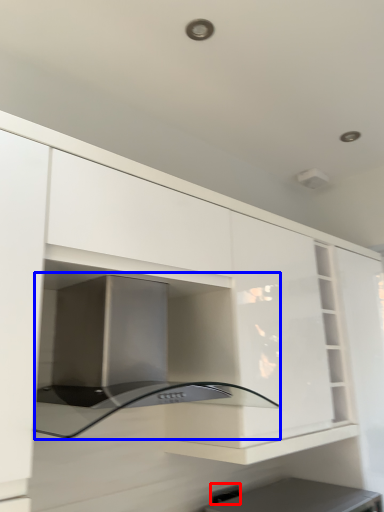
Question: Which object is further to the camera taking this photo, electric outlet (highlighted by a red box) or oven (highlighted by a blue box)?

Choices:
 (A) electric outlet
 (B) oven

Answer: (A)